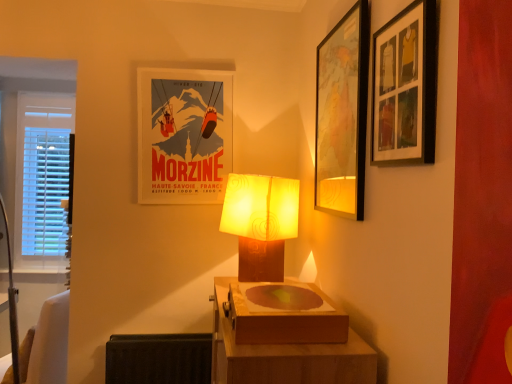
Question: Is black fabric radiator at lower left oriented towards wooden box at center?

Choices:
 (A) no
 (B) yes

Answer: (A)

Question: Does black fabric radiator at lower left have a smaller size compared to wooden box at center?

Choices:
 (A) no
 (B) yes

Answer: (A)

Question: Is black fabric radiator at lower left in front of wooden box at center?

Choices:
 (A) yes
 (B) no

Answer: (B)

Question: Can you confirm if black fabric radiator at lower left is bigger than wooden box at center?

Choices:
 (A) no
 (B) yes

Answer: (B)

Question: Considering the relative positions of black fabric radiator at lower left and wooden box at center in the image provided, is black fabric radiator at lower left behind wooden box at center?

Choices:
 (A) yes
 (B) no

Answer: (A)

Question: From the image's perspective, does black fabric radiator at lower left appear lower than wooden box at center?

Choices:
 (A) no
 (B) yes

Answer: (B)

Question: From a real-world perspective, is matte brown lamp at center positioned over wooden picture frame at upper right, acting as the 3th picture frame starting from the back, based on gravity?

Choices:
 (A) yes
 (B) no

Answer: (B)

Question: Considering the relative sizes of matte brown lamp at center and wooden picture frame at upper right, acting as the third picture frame starting from the left, in the image provided, is matte brown lamp at center shorter than wooden picture frame at upper right, acting as the third picture frame starting from the left,?

Choices:
 (A) no
 (B) yes

Answer: (A)

Question: Is matte brown lamp at center with wooden picture frame at upper right, acting as the third picture frame starting from the left?

Choices:
 (A) yes
 (B) no

Answer: (B)

Question: From the image's perspective, would you say matte brown lamp at center is shown under wooden picture frame at upper right, acting as the 3th picture frame starting from the back?

Choices:
 (A) no
 (B) yes

Answer: (B)

Question: Would you say wooden picture frame at upper right, the 1th picture frame viewed from the front, is part of matte brown lamp at center's contents?

Choices:
 (A) no
 (B) yes

Answer: (A)

Question: Is matte brown lamp at center outside wooden picture frame at upper right, the 1th picture frame viewed from the front?

Choices:
 (A) no
 (B) yes

Answer: (B)

Question: Does matte brown lamp at center have a smaller size compared to wooden table at center?

Choices:
 (A) yes
 (B) no

Answer: (A)